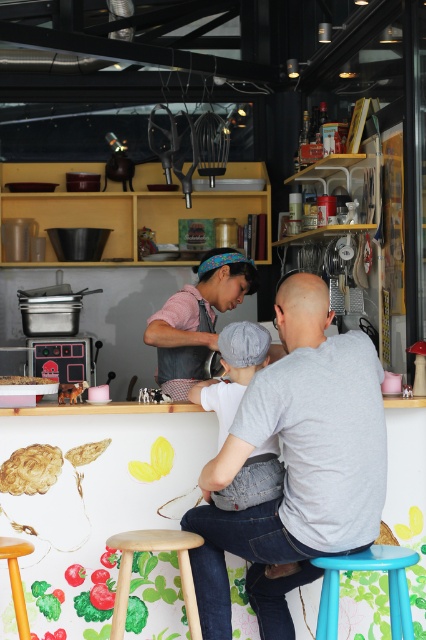
Is the position of pink fabric apron at center more distant than that of smooth brown bread at center?

No, it is in front of smooth brown bread at center.

Between point (226, 264) and point (60, 394), which one is positioned behind?

The point (226, 264) is more distant.

At what (x,y) coordinates should I click in order to perform the action: click on pink fabric apron at center. Please return your answer as a coordinate pair (x, y). This screenshot has width=426, height=640. Looking at the image, I should click on 198,316.

Between gray cotton shirt at center and wooden stool at lower left, which one has more height?

Standing taller between the two is gray cotton shirt at center.

Which is in front, point (261, 506) or point (31, 547)?

Positioned in front is point (31, 547).

In order to click on gray cotton shirt at center in this screenshot , I will do `click(296, 465)`.

Who is shorter, blue plastic stool at lower right or white glossy cake at center?

Standing shorter between the two is white glossy cake at center.

Measure the distance between blue plastic stool at lower right and camera.

blue plastic stool at lower right is 9.16 feet from camera.

Locate an element on the screen. The width and height of the screenshot is (426, 640). blue plastic stool at lower right is located at coordinates (368, 570).